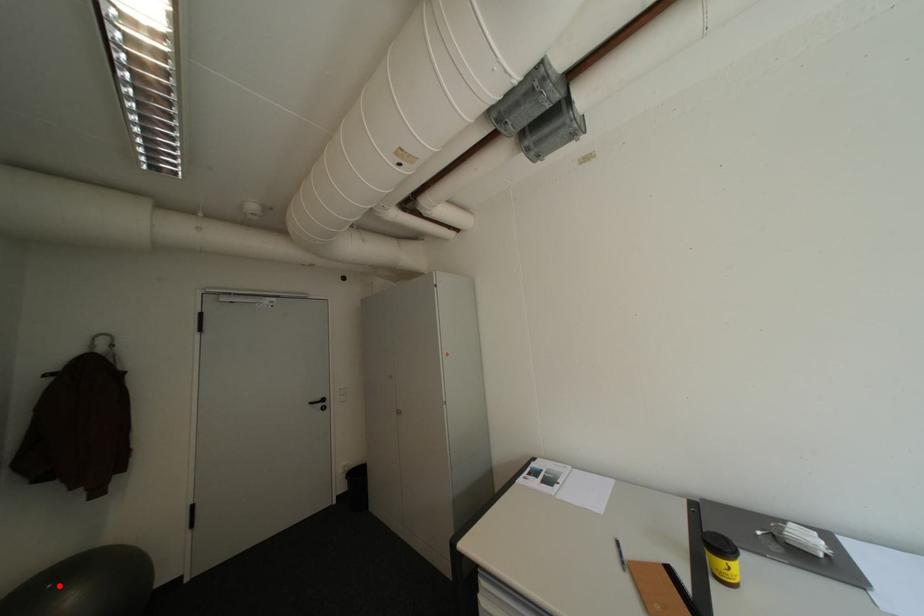
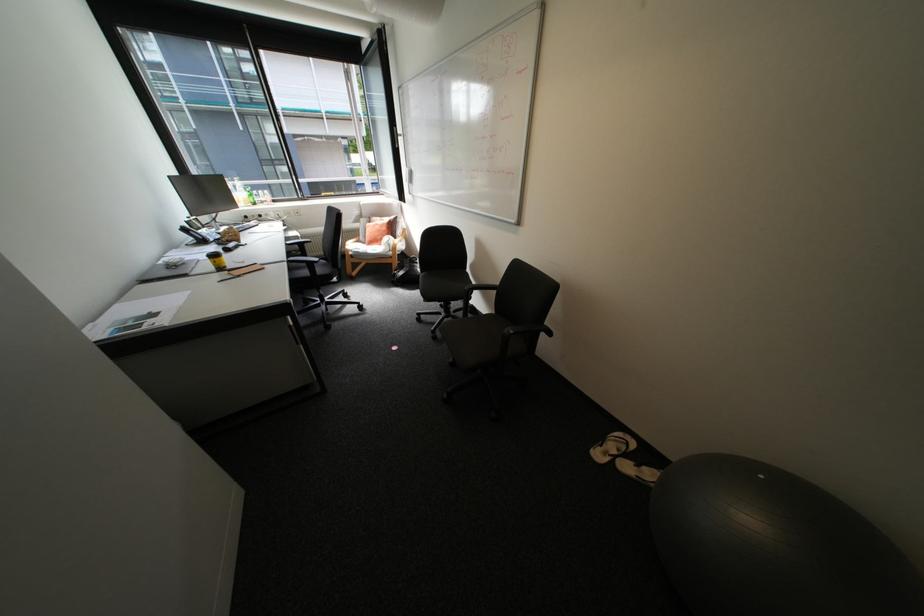
Question: I am providing you with two images of the same scene from different viewpoints. Given a red point in image1, look at the same physical point in image2. Is it:

Choices:
 (A) Closer to the viewpoint
 (B) Farther from the viewpoint

Answer: (A)